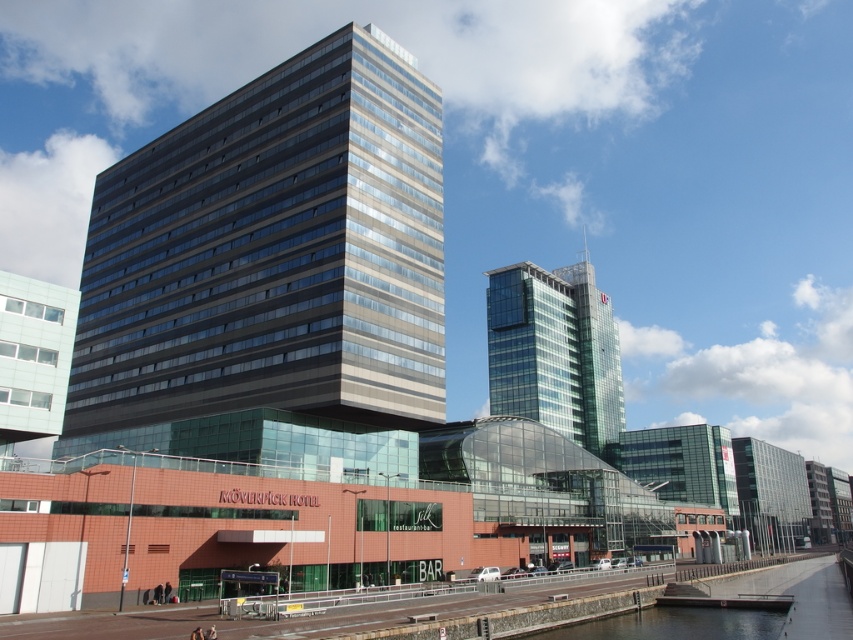
Question: Is clear glass skyscraper at center to the right of smooth concrete river at lower center from the viewer's perspective?

Choices:
 (A) no
 (B) yes

Answer: (B)

Question: Does glassy metallic building at center have a lesser width compared to smooth concrete river at lower center?

Choices:
 (A) no
 (B) yes

Answer: (A)

Question: Among these points, which one is nearest to the camera?

Choices:
 (A) (515, 339)
 (B) (596, 625)

Answer: (B)

Question: Which object is farther from the camera taking this photo?

Choices:
 (A) clear glass skyscraper at center
 (B) smooth concrete river at lower center
 (C) glassy metallic building at center

Answer: (A)

Question: Among these points, which one is farthest from the camera?

Choices:
 (A) (712, 609)
 (B) (183, 368)

Answer: (B)

Question: Does glassy metallic building at center appear under clear glass skyscraper at center?

Choices:
 (A) yes
 (B) no

Answer: (B)